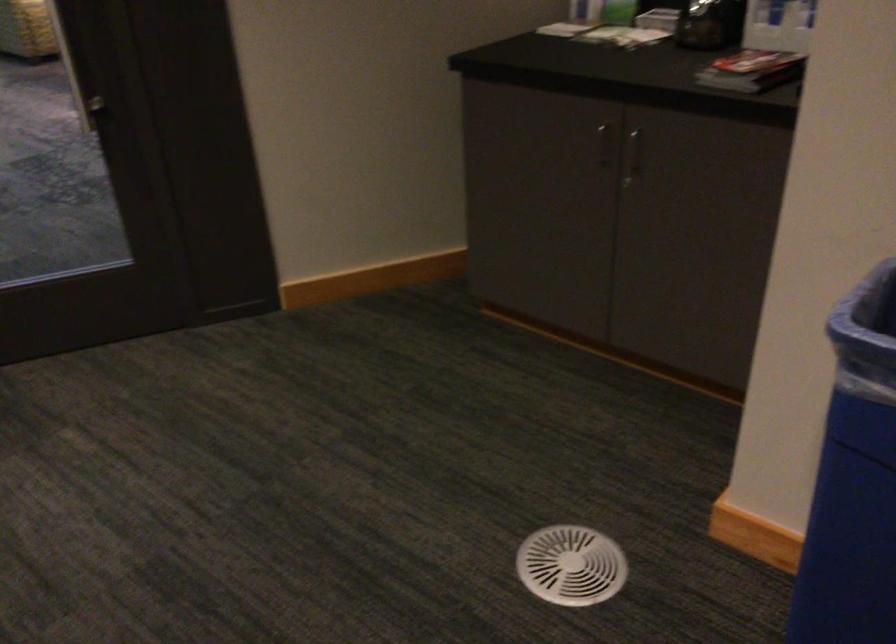
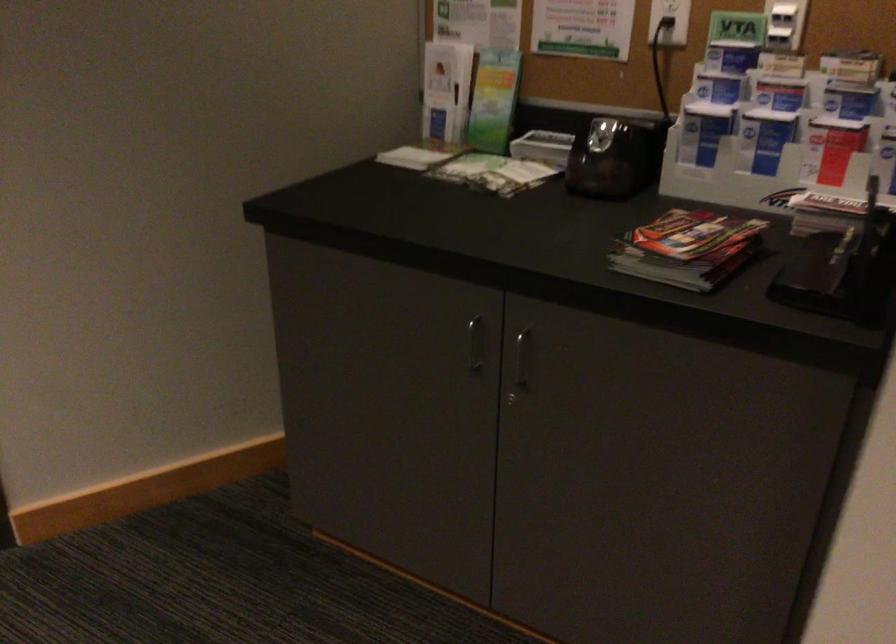
The point at (600, 144) is marked in the first image. Where is the corresponding point in the second image?

(475, 343)